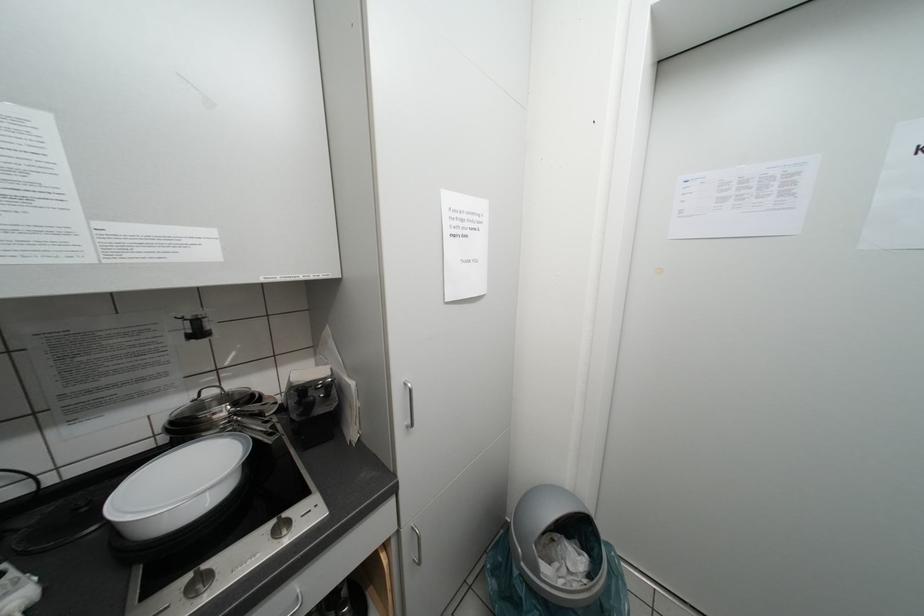
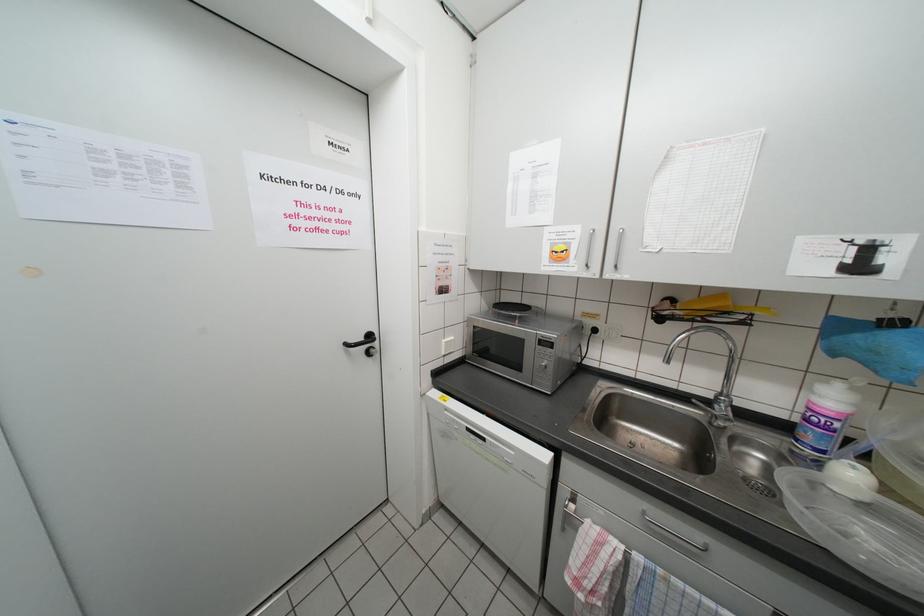
Question: The first image is from the beginning of the video and the second image is from the end. How did the camera likely rotate when shooting the video?

Choices:
 (A) Left
 (B) Right
 (C) Up
 (D) Down

Answer: (B)